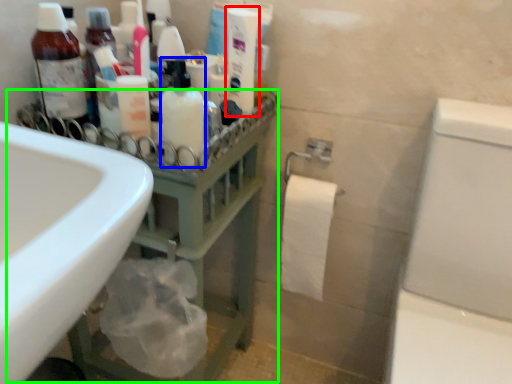
Question: Which object is positioned closest to cleaning product (highlighted by a red box)? Select from mouthwash (highlighted by a blue box) and balustrade (highlighted by a green box).

Choices:
 (A) mouthwash
 (B) balustrade

Answer: (A)